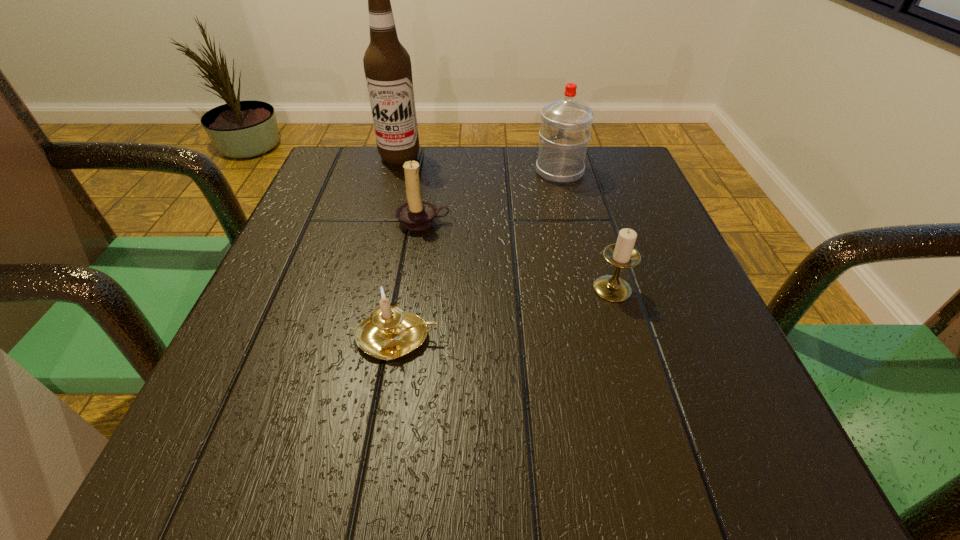
You are a GUI agent. You are given a task and a screenshot of the screen. Output one action in this format:
    pyautogui.click(x=<x>, y=<y>)
    Task: Click on the vacant space that is in between the shortest candle holder and the third nearest object
    
    Given the screenshot: What is the action you would take?
    pyautogui.click(x=411, y=279)

Locate an element on the screen. This screenshot has height=540, width=960. unoccupied position between the shortest candle holder and the tallest object is located at coordinates (398, 247).

Where is `vacant region between the alcohol and the shortest candle holder`? vacant region between the alcohol and the shortest candle holder is located at coordinates (398, 247).

Locate an element on the screen. The image size is (960, 540). vacant space that is in between the second farthest candle holder and the nearest object is located at coordinates (505, 313).

Where is `vacant area that lies between the shortest object and the rightmost candle holder`? The width and height of the screenshot is (960, 540). vacant area that lies between the shortest object and the rightmost candle holder is located at coordinates (505, 313).

You are a GUI agent. You are given a task and a screenshot of the screen. Output one action in this format:
    pyautogui.click(x=<x>, y=<y>)
    Task: Click on the object that stands as the third closest to the nearest object
    The width and height of the screenshot is (960, 540).
    Given the screenshot: What is the action you would take?
    pyautogui.click(x=565, y=131)

Where is `object that stands as the second closest to the third nearest object`? This screenshot has height=540, width=960. object that stands as the second closest to the third nearest object is located at coordinates (389, 333).

Locate an element on the screen. the second closest candle holder to the second tallest object is located at coordinates (622, 254).

Point out which candle holder is positioned as the second nearest to the nearest object. Please provide its 2D coordinates. Your answer should be formatted as a tuple, i.e. [(x, y)], where the tuple contains the x and y coordinates of a point satisfying the conditions above.

[(622, 254)]

The width and height of the screenshot is (960, 540). What are the coordinates of `vacant point that satisfies the following two spatial constraints: 1. on the label of the second nearest candle holder; 2. on the left side of the alcohol` in the screenshot? It's located at (366, 288).